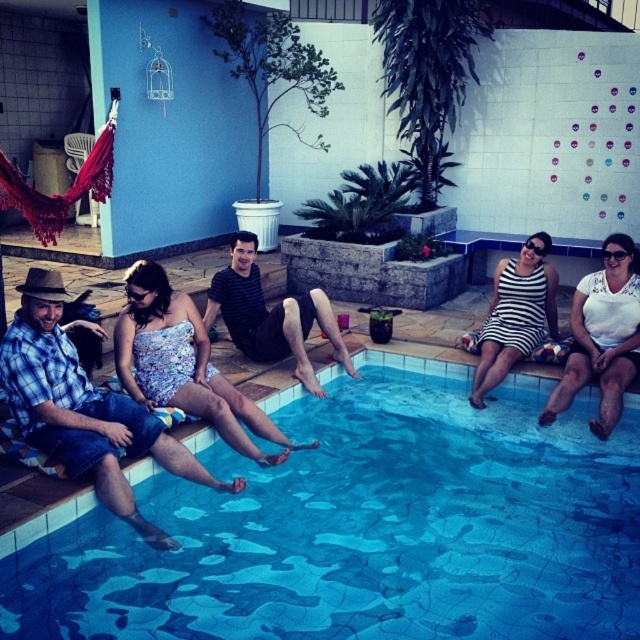
Question: Is blue plaid shirt at left below striped fabric shirt at center?

Choices:
 (A) no
 (B) yes

Answer: (B)

Question: Does floral fabric dress at center appear on the left side of striped fabric dress at center?

Choices:
 (A) yes
 (B) no

Answer: (A)

Question: Does blue mosaic tiles at center have a greater width compared to striped fabric shirt at center?

Choices:
 (A) yes
 (B) no

Answer: (A)

Question: Which point is farther to the camera?

Choices:
 (A) striped fabric dress at center
 (B) floral fabric dress at center

Answer: (A)

Question: Which is farther from the floral fabric dress at center?

Choices:
 (A) blue plaid shirt at left
 (B) striped fabric shirt at center
 (C) blue mosaic tiles at center

Answer: (C)

Question: Considering the real-world distances, which object is farthest from the white textured dress at lower right?

Choices:
 (A) striped fabric dress at center
 (B) floral fabric dress at center
 (C) blue plaid shirt at left

Answer: (C)